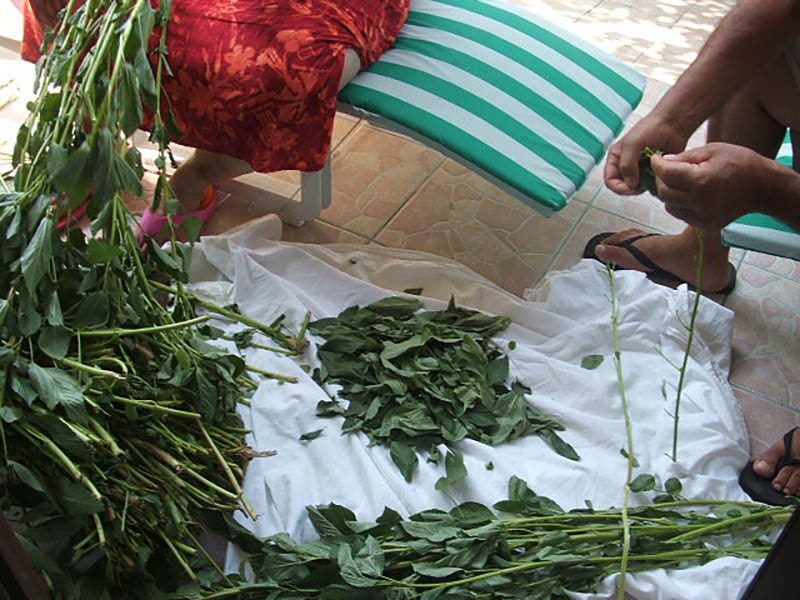
This screenshot has width=800, height=600. I want to click on white cloth, so pyautogui.click(x=576, y=435).